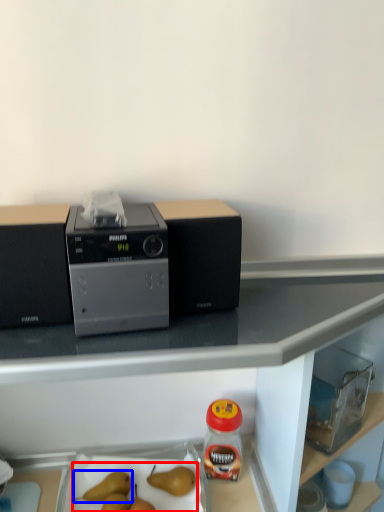
Question: Which object is closer to the camera taking this photo, fruit (highlighted by a red box) or fruit (highlighted by a blue box)?

Choices:
 (A) fruit
 (B) fruit

Answer: (A)